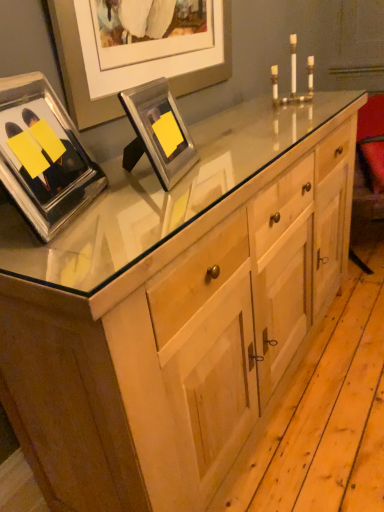
Where is `free space on the front side of gold metallic candle holder at upper center`? The width and height of the screenshot is (384, 512). free space on the front side of gold metallic candle holder at upper center is located at coordinates (305, 113).